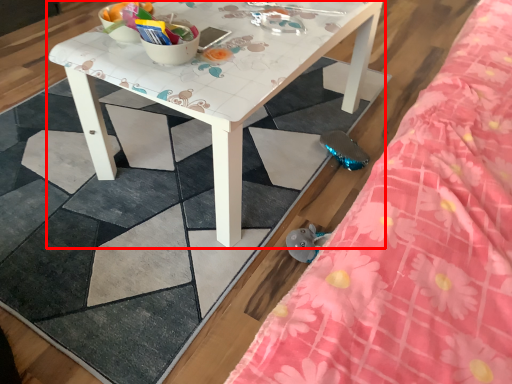
Question: From the image's perspective, considering the relative positions of table (annotated by the red box) and bed in the image provided, where is table (annotated by the red box) located with respect to the staircase?

Choices:
 (A) below
 (B) above

Answer: (B)